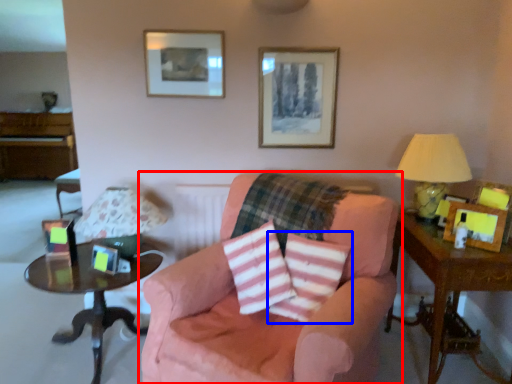
Question: Which of the following is the closest to the observer, chair (highlighted by a red box) or throw pillow (highlighted by a blue box)?

Choices:
 (A) chair
 (B) throw pillow

Answer: (A)